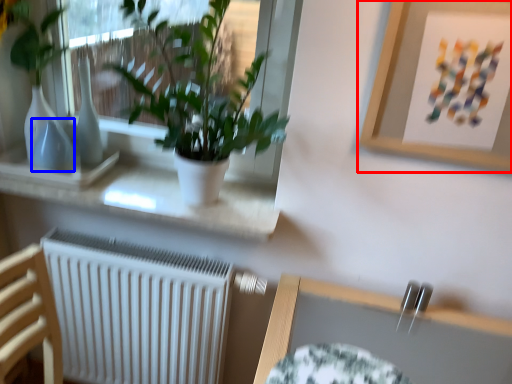
Question: Which object appears closest to the camera in this image, picture frame (highlighted by a red box) or vase (highlighted by a blue box)?

Choices:
 (A) picture frame
 (B) vase

Answer: (A)